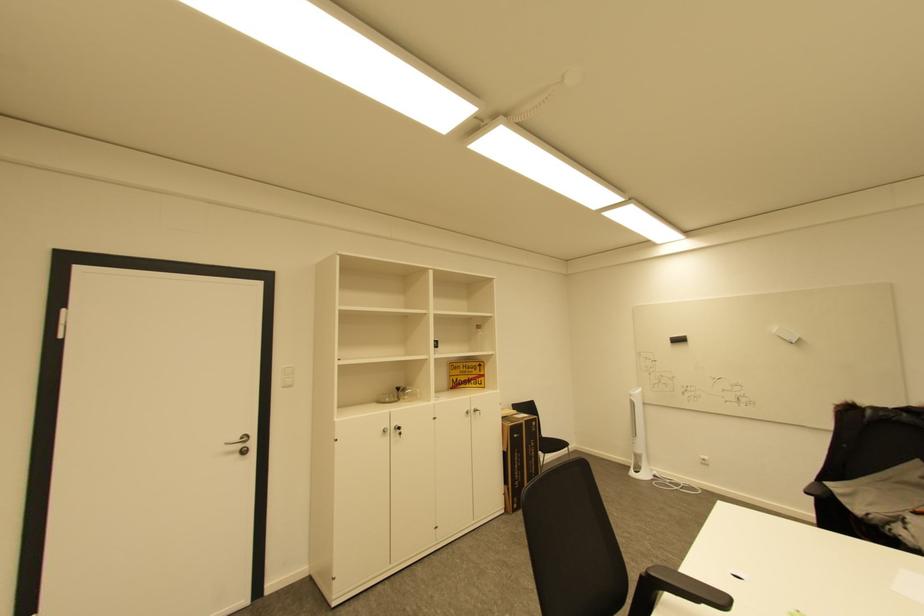
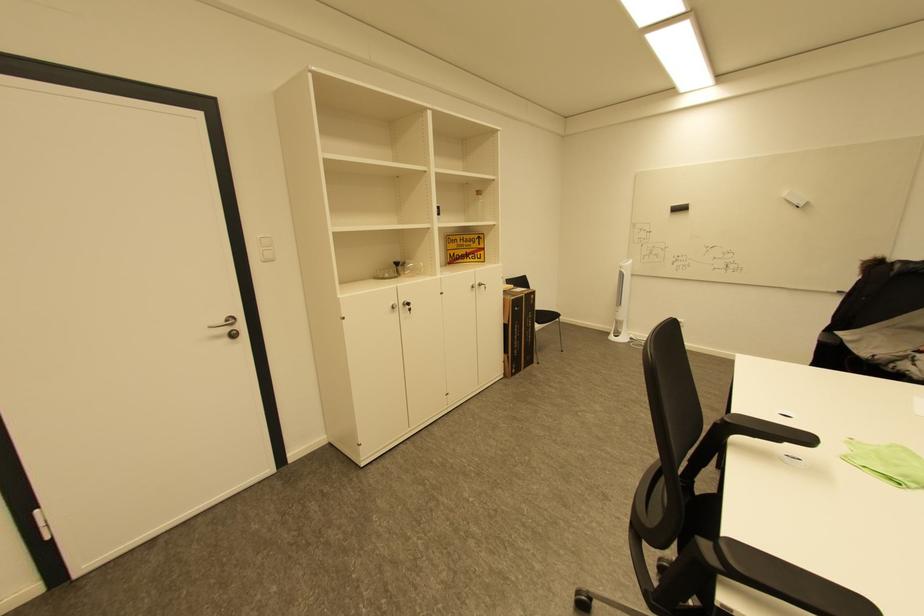
The images are taken continuously from a first-person perspective. In which direction are you moving?

The cameraman walked toward left, forward.